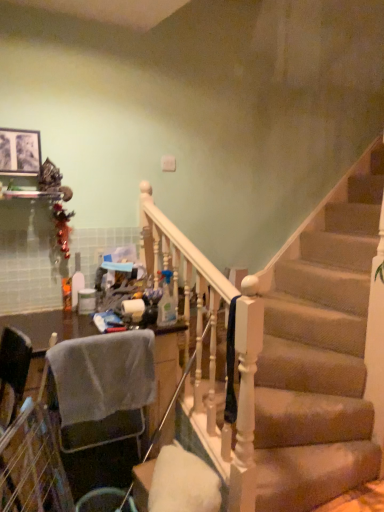
Question: Could translucent plastic bottle at center, which ranks as the first bottle in back-to-front order, be considered to be inside translucent plastic spray bottle at center, which ranks as the 1th bottle in right-to-left order?

Choices:
 (A) no
 (B) yes

Answer: (A)

Question: Does translucent plastic spray bottle at center, which ranks as the 1th bottle in right-to-left order, lie in front of translucent plastic bottle at center, acting as the first bottle starting from the left?

Choices:
 (A) yes
 (B) no

Answer: (A)

Question: Is the surface of translucent plastic spray bottle at center, the first bottle viewed from the front, in direct contact with translucent plastic bottle at center, acting as the first bottle starting from the left?

Choices:
 (A) yes
 (B) no

Answer: (B)

Question: From the image's perspective, is translucent plastic spray bottle at center, the first bottle viewed from the front, over translucent plastic bottle at center, arranged as the 2th bottle when viewed from the front?

Choices:
 (A) no
 (B) yes

Answer: (A)

Question: Are translucent plastic spray bottle at center, the 2th bottle from the back, and translucent plastic bottle at center, arranged as the 2th bottle when viewed from the front, located far from each other?

Choices:
 (A) no
 (B) yes

Answer: (A)

Question: Considering the relative sizes of translucent plastic spray bottle at center, which ranks as the 1th bottle in right-to-left order, and translucent plastic bottle at center, positioned as the 2th bottle in right-to-left order, in the image provided, is translucent plastic spray bottle at center, which ranks as the 1th bottle in right-to-left order, taller than translucent plastic bottle at center, positioned as the 2th bottle in right-to-left order,?

Choices:
 (A) yes
 (B) no

Answer: (B)

Question: From a real-world perspective, is metallic silver trash bin/can at lower left located higher than matte black picture frame at upper left?

Choices:
 (A) no
 (B) yes

Answer: (A)

Question: From a real-world perspective, is metallic silver trash bin/can at lower left positioned under matte black picture frame at upper left based on gravity?

Choices:
 (A) no
 (B) yes

Answer: (B)

Question: Is metallic silver trash bin/can at lower left aimed at matte black picture frame at upper left?

Choices:
 (A) no
 (B) yes

Answer: (A)

Question: Is the surface of metallic silver trash bin/can at lower left in direct contact with matte black picture frame at upper left?

Choices:
 (A) no
 (B) yes

Answer: (A)

Question: Can you confirm if metallic silver trash bin/can at lower left is smaller than matte black picture frame at upper left?

Choices:
 (A) no
 (B) yes

Answer: (A)

Question: Is metallic silver trash bin/can at lower left outside matte black picture frame at upper left?

Choices:
 (A) yes
 (B) no

Answer: (A)

Question: Is translucent plastic spray bottle at center, which ranks as the 1th bottle in right-to-left order, next to matte black picture frame at upper left?

Choices:
 (A) yes
 (B) no

Answer: (B)